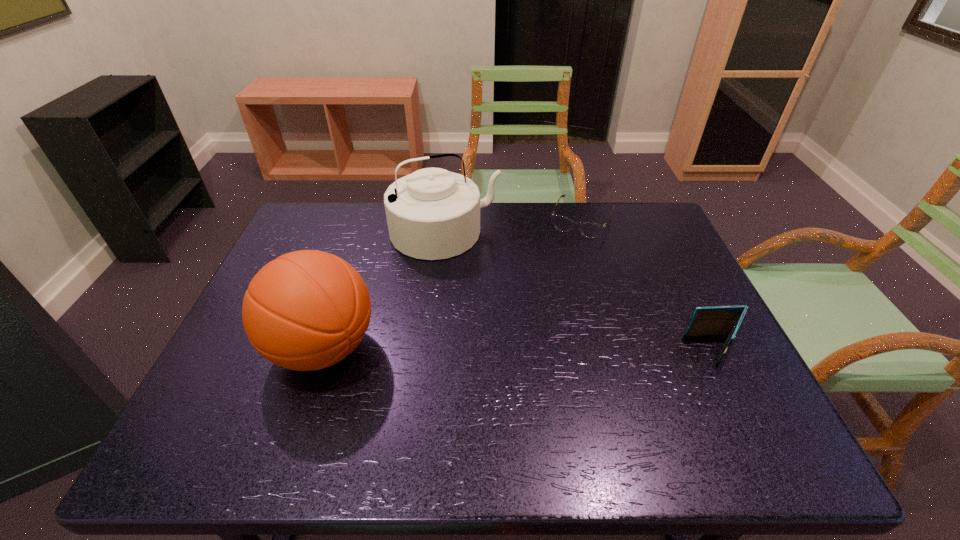
At what (x,y) coordinates should I click in order to perform the action: click on free space between the wallet and the basketball. Please return your answer as a coordinate pair (x, y). This screenshot has width=960, height=540. Looking at the image, I should click on (519, 349).

You are a GUI agent. You are given a task and a screenshot of the screen. Output one action in this format:
    pyautogui.click(x=<x>, y=<y>)
    Task: Click on the unoccupied area between the basketball and the third tallest object
    
    Given the screenshot: What is the action you would take?
    pyautogui.click(x=519, y=349)

Identify which object is located as the nearest to the kettle. Please provide its 2D coordinates. Your answer should be formatted as a tuple, i.e. [(x, y)], where the tuple contains the x and y coordinates of a point satisfying the conditions above.

[(591, 230)]

Find the location of a particular element. The image size is (960, 540). the third closest object relative to the kettle is located at coordinates (718, 320).

What are the coordinates of `vacant space that satisfies the following two spatial constraints: 1. on the front side of the third object from left to right; 2. on the exterior surface of the rightmost object` in the screenshot? It's located at (620, 349).

Find the location of a particular element. free space in the image that satisfies the following two spatial constraints: 1. on the front side of the basketball; 2. on the exterior surface of the rightmost object is located at coordinates (323, 349).

In order to click on blank area in the image that satisfies the following two spatial constraints: 1. on the back side of the basketball; 2. on the left side of the third object from left to right in this screenshot , I will do `click(366, 220)`.

Where is `vacant space that satisfies the following two spatial constraints: 1. on the front side of the shortest object; 2. on the exterior surface of the rightmost object`? Image resolution: width=960 pixels, height=540 pixels. vacant space that satisfies the following two spatial constraints: 1. on the front side of the shortest object; 2. on the exterior surface of the rightmost object is located at coordinates (620, 349).

You are a GUI agent. You are given a task and a screenshot of the screen. Output one action in this format:
    pyautogui.click(x=<x>, y=<y>)
    Task: Click on the free spot that satisfies the following two spatial constraints: 1. on the front side of the wallet; 2. on the exterior surface of the second object from right to left
    The image size is (960, 540).
    Given the screenshot: What is the action you would take?
    pyautogui.click(x=620, y=349)